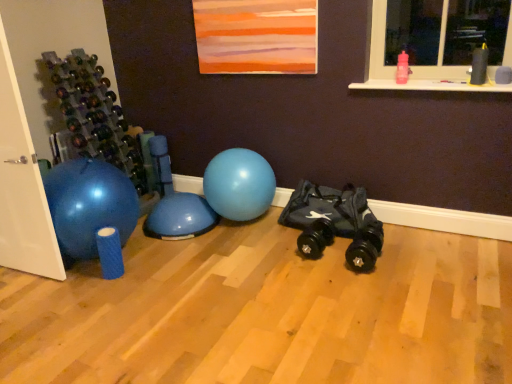
Question: From a real-world perspective, is black rubber toy car at center physically located above or below blue rubber ball at center?

Choices:
 (A) above
 (B) below

Answer: (B)

Question: Is black rubber toy car at center spatially inside blue rubber ball at center, or outside of it?

Choices:
 (A) outside
 (B) inside

Answer: (A)

Question: Which of these objects is positioned farthest from the black rubber toy car at center?

Choices:
 (A) blue rubber ball at center
 (B) pink plastic water bottle at upper right

Answer: (B)

Question: Considering the real-world distances, which object is closest to the blue rubber ball at center?

Choices:
 (A) black rubber toy car at center
 (B) pink plastic water bottle at upper right

Answer: (A)